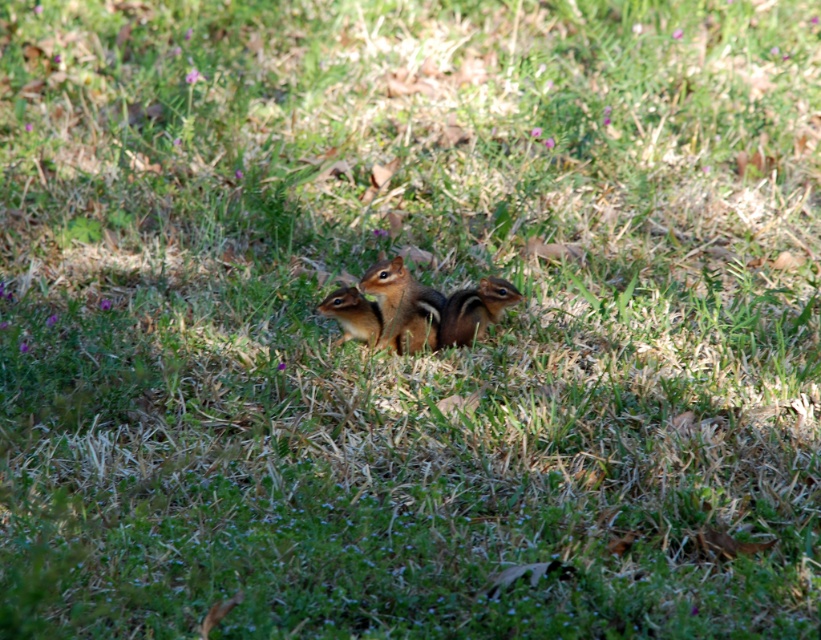
Question: Can you confirm if brown furry squirrel at center is smaller than shiny brown squirrel at center?

Choices:
 (A) yes
 (B) no

Answer: (B)

Question: Which object is farther from the camera taking this photo?

Choices:
 (A) shiny brown squirrel at center
 (B) golden-brown fur squirrel at center

Answer: (A)

Question: Which is farther from the shiny brown squirrel at center?

Choices:
 (A) brown furry squirrel at center
 (B) golden-brown fur squirrel at center

Answer: (B)

Question: Can you confirm if brown furry squirrel at center is thinner than shiny brown squirrel at center?

Choices:
 (A) no
 (B) yes

Answer: (A)

Question: Does brown furry squirrel at center have a larger size compared to shiny brown squirrel at center?

Choices:
 (A) yes
 (B) no

Answer: (A)

Question: Estimate the real-world distances between objects in this image. Which object is farther from the brown furry squirrel at center?

Choices:
 (A) shiny brown squirrel at center
 (B) golden-brown fur squirrel at center

Answer: (A)